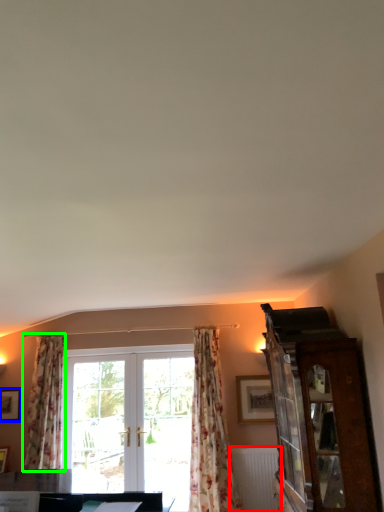
Question: Which object is positioned closest to radiator (highlighted by a red box)? Select from picture frame (highlighted by a blue box) and curtain (highlighted by a green box).

Choices:
 (A) picture frame
 (B) curtain

Answer: (B)